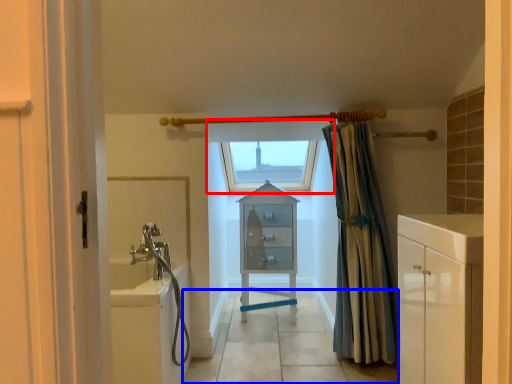
Question: Which object is further to the camera taking this photo, window (highlighted by a red box) or path (highlighted by a blue box)?

Choices:
 (A) window
 (B) path

Answer: (A)